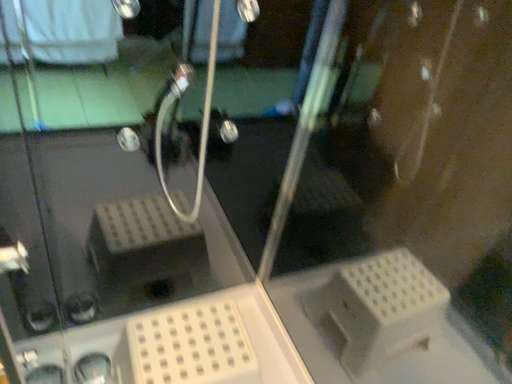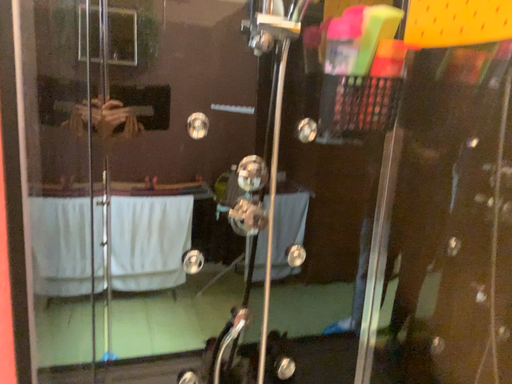
Question: Which way did the camera rotate in the video?

Choices:
 (A) rotated right
 (B) rotated left

Answer: (B)